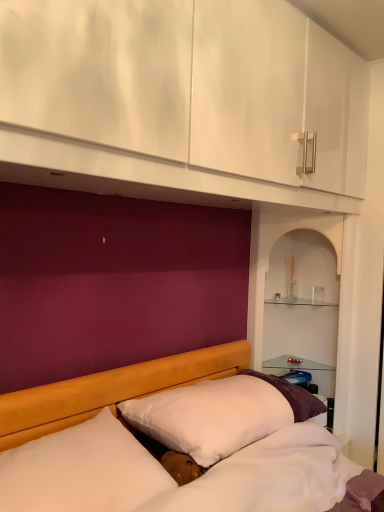
Question: Is clear glass shelves at right, which ranks as the 2th shelf in top-to-bottom order, to the left of white soft pillow at center, the 1th pillow when ordered from back to front, from the viewer's perspective?

Choices:
 (A) yes
 (B) no

Answer: (B)

Question: Can you confirm if clear glass shelves at right, which ranks as the 2th shelf in top-to-bottom order, is wider than white soft pillow at center, the second pillow in the front-to-back sequence?

Choices:
 (A) yes
 (B) no

Answer: (B)

Question: Is clear glass shelves at right, arranged as the 1th shelf when ordered from the bottom, smaller than white soft pillow at center, the 1th pillow when ordered from back to front?

Choices:
 (A) no
 (B) yes

Answer: (A)

Question: Does clear glass shelves at right, arranged as the 1th shelf when ordered from the bottom, turn towards white soft pillow at center, the second pillow in the front-to-back sequence?

Choices:
 (A) yes
 (B) no

Answer: (B)

Question: Is clear glass shelves at right, arranged as the 1th shelf when ordered from the bottom, not inside white soft pillow at center, the 1th pillow when ordered from back to front?

Choices:
 (A) yes
 (B) no

Answer: (A)

Question: Is clear glass shelf at upper center, placed as the 1th shelf when sorted from top to bottom, bigger or smaller than white soft pillow at center, the second pillow in the front-to-back sequence?

Choices:
 (A) small
 (B) big

Answer: (A)

Question: Would you say clear glass shelf at upper center, placed as the 1th shelf when sorted from top to bottom, is to the left or to the right of white soft pillow at center, the 1th pillow when ordered from back to front, in the picture?

Choices:
 (A) right
 (B) left

Answer: (A)

Question: From a real-world perspective, is clear glass shelf at upper center, placed as the 1th shelf when sorted from top to bottom, positioned above or below white soft pillow at center, the second pillow in the front-to-back sequence?

Choices:
 (A) above
 (B) below

Answer: (A)

Question: Is clear glass shelf at upper center, the 2th shelf when ordered from bottom to top, in front of or behind white soft pillow at center, the second pillow in the front-to-back sequence, in the image?

Choices:
 (A) behind
 (B) front

Answer: (A)

Question: Is white soft pillow at center, the 1th pillow when ordered from back to front, inside or outside of clear glass shelf at upper center, placed as the 1th shelf when sorted from top to bottom?

Choices:
 (A) outside
 (B) inside

Answer: (A)

Question: Based on their positions, is white soft pillow at center, the second pillow in the front-to-back sequence, located to the left or right of clear glass shelf at upper center, placed as the 1th shelf when sorted from top to bottom?

Choices:
 (A) right
 (B) left

Answer: (B)

Question: From their relative heights in the image, would you say white soft pillow at center, the 1th pillow when ordered from back to front, is taller or shorter than clear glass shelf at upper center, the 2th shelf when ordered from bottom to top?

Choices:
 (A) tall
 (B) short

Answer: (A)

Question: Looking at the image, does white soft pillow at center, the second pillow in the front-to-back sequence, seem bigger or smaller compared to clear glass shelf at upper center, placed as the 1th shelf when sorted from top to bottom?

Choices:
 (A) small
 (B) big

Answer: (B)

Question: From a real-world perspective, is clear glass shelves at right, which ranks as the 2th shelf in top-to-bottom order, positioned above or below clear glass shelf at upper center, the 2th shelf when ordered from bottom to top?

Choices:
 (A) above
 (B) below

Answer: (B)

Question: Is clear glass shelves at right, which ranks as the 2th shelf in top-to-bottom order, in front of or behind clear glass shelf at upper center, the 2th shelf when ordered from bottom to top, in the image?

Choices:
 (A) behind
 (B) front

Answer: (B)